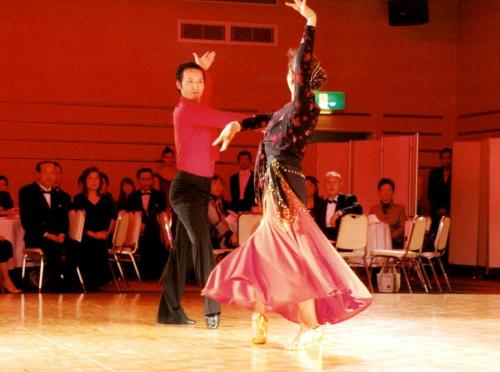
Identify the location of folding screen. Image resolution: width=500 pixels, height=372 pixels. pos(363,173).